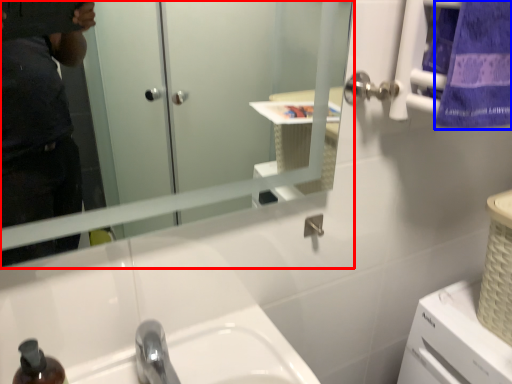
Question: Which object appears closest to the camera in this image, mirror (highlighted by a red box) or towel/napkin (highlighted by a blue box)?

Choices:
 (A) mirror
 (B) towel/napkin

Answer: (A)